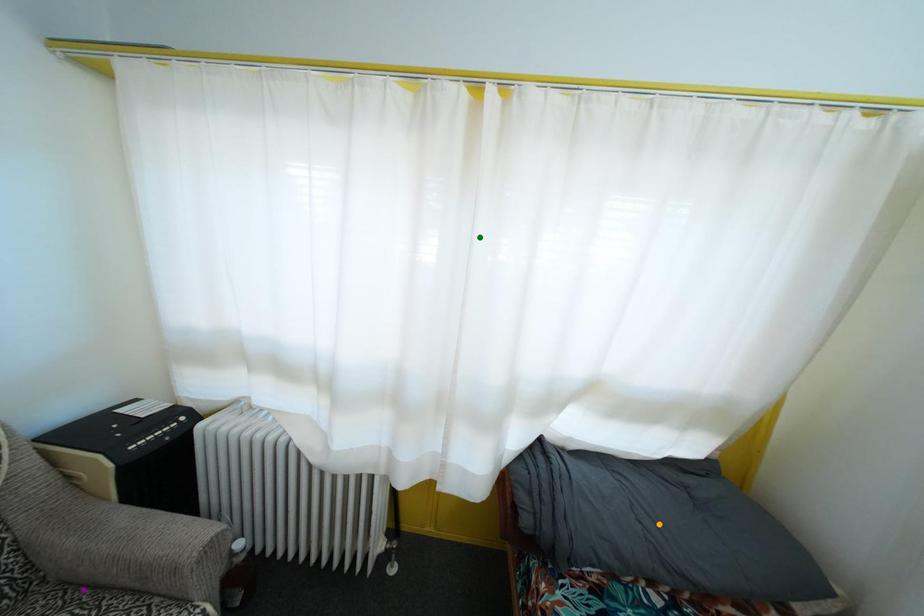
Order these from nearest to farthest:
green point, purple point, orange point

purple point
green point
orange point